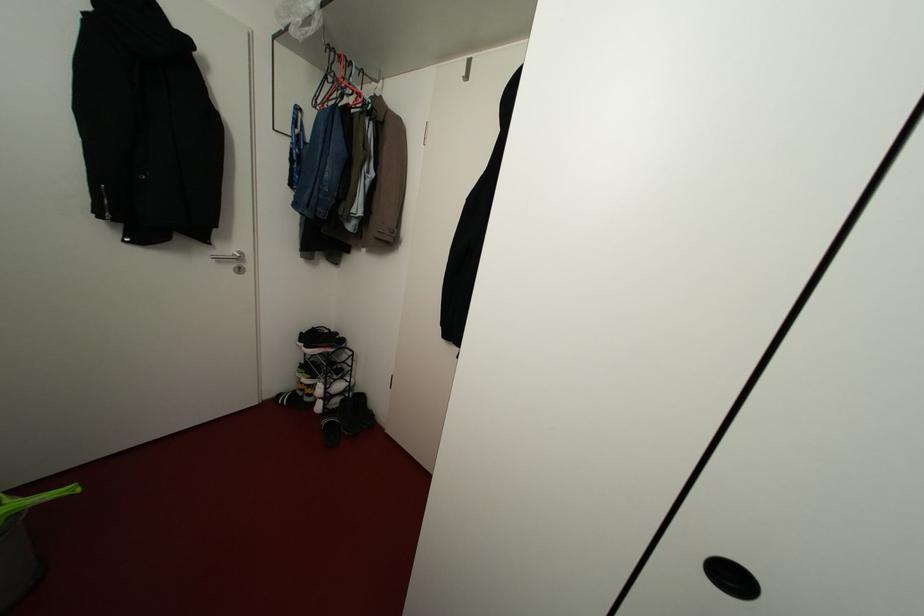
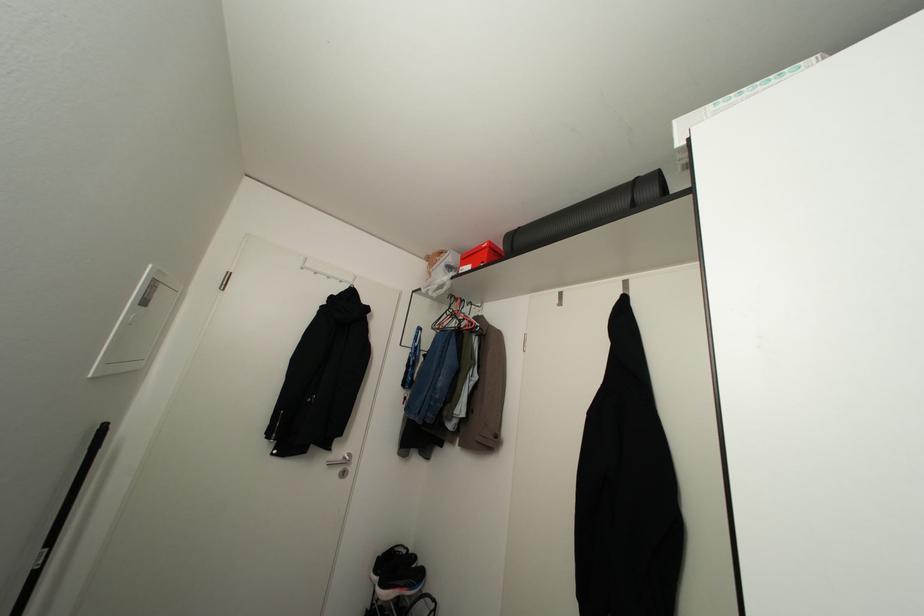
Where in the second image is the point corresponding to pixel 330 47 from the first image?

(451, 294)